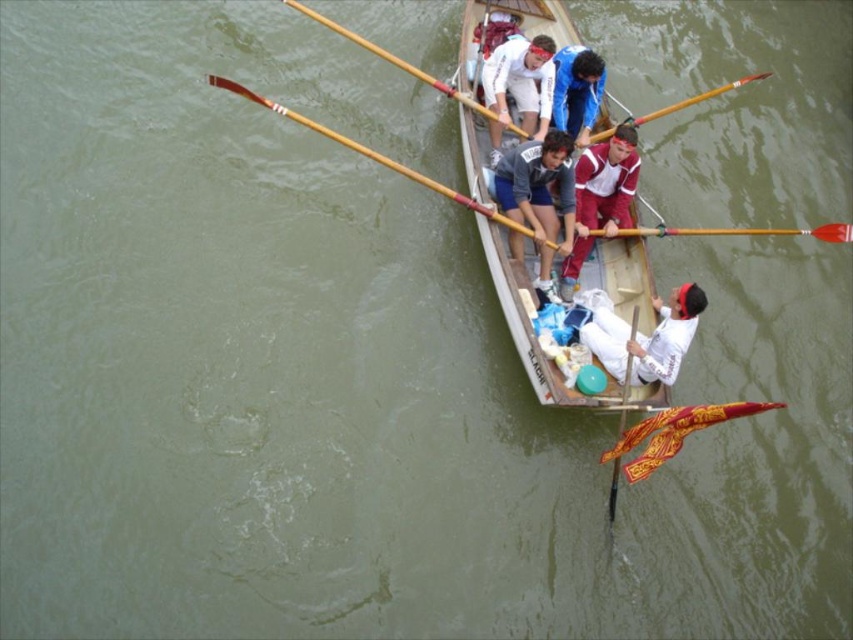
Question: Which point is closer to the camera?

Choices:
 (A) (599, 164)
 (B) (611, 320)
 (C) (666, 230)

Answer: (B)

Question: Which object is positioned closest to the white cotton shirt at center?

Choices:
 (A) white matte shirt at center
 (B) wooden polished paddle at lower center

Answer: (A)

Question: Which of the following is the closest to the observer?

Choices:
 (A) (416, 177)
 (B) (604, 148)
 (C) (566, 221)

Answer: (C)

Question: Can you confirm if matte gray jacket at center is positioned below maroon jersey at center?

Choices:
 (A) no
 (B) yes

Answer: (A)

Question: Does wooden polished oar at upper center appear under wooden polished paddle at lower center?

Choices:
 (A) no
 (B) yes

Answer: (A)

Question: From the image, what is the correct spatial relationship of blue fabric jacket at center in relation to wooden polished oar at center?

Choices:
 (A) right
 (B) left

Answer: (A)